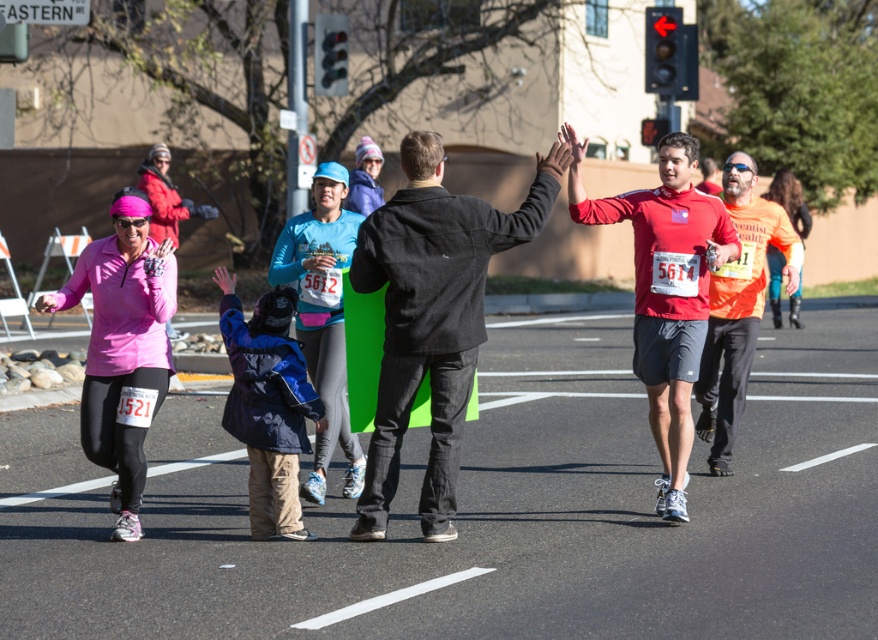
Question: Is the position of dark gray jacket at center less distant than that of orange fabric shirt at right?

Choices:
 (A) no
 (B) yes

Answer: (B)

Question: Can you confirm if dark gray jacket at center is positioned to the left of orange fabric shirt at right?

Choices:
 (A) no
 (B) yes

Answer: (B)

Question: Which of these objects is positioned closest to the dark gray jacket at center?

Choices:
 (A) orange fabric shirt at right
 (B) matte pink jacket at left

Answer: (B)

Question: Can you confirm if matte red shirt at center is positioned to the right of matte pink jacket at left?

Choices:
 (A) yes
 (B) no

Answer: (A)

Question: Estimate the real-world distances between objects in this image. Which object is closer to the orange fabric shirt at right?

Choices:
 (A) dark gray jacket at center
 (B) matte pink jacket at left
 (C) matte red shirt at center

Answer: (C)

Question: Which object appears closest to the camera in this image?

Choices:
 (A) matte pink jacket at left
 (B) orange fabric shirt at right
 (C) matte red shirt at center

Answer: (A)